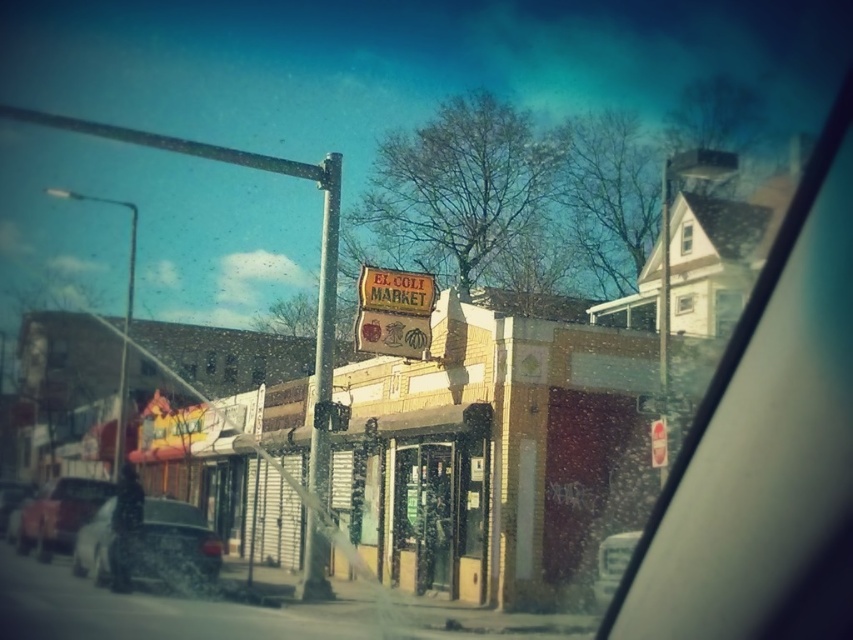
You are a passenger in a car and want to know where the transparent glass windshield at upper right is located in the image. Can you tell me its position using coordinates?

The transparent glass windshield at upper right is located at position coordinates point (766, 445).

You are a delivery driver who needs to park your car in front of El Soli Market. The parking space is narrow, and you must ensure that your vehicle doesn not hit any objects. Based on the scene, which object between the metallic pole at center and the wooden signboard at center is bigger and requires more caution?

The metallic pole at center is larger in size compared to the wooden signboard at center, so it requires more caution to avoid collision.

You are a passenger in a car and looking out the window. You see a point marked at coordinates (175, 541). What object is located at that point?

The point at (175, 541) is occupied by a white matte car at lower left.